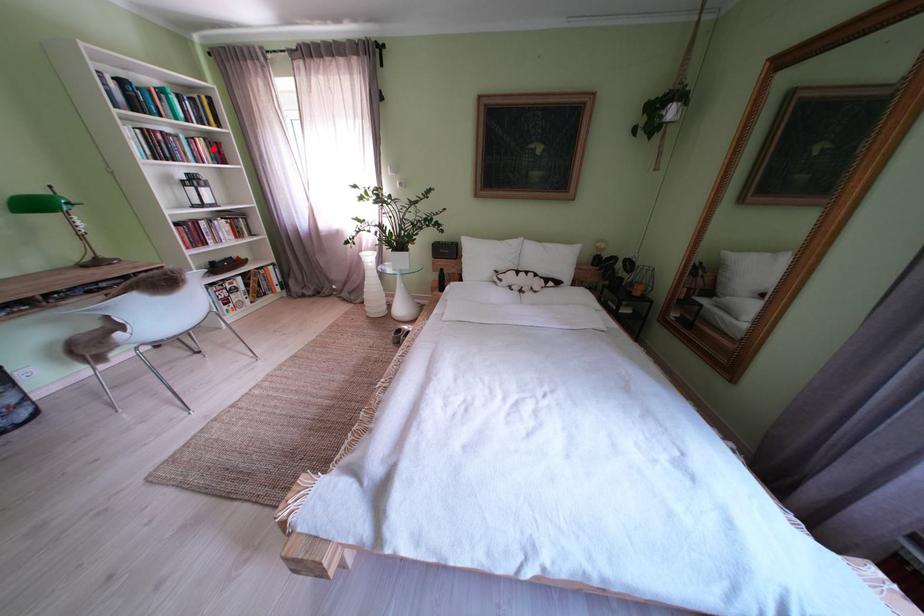
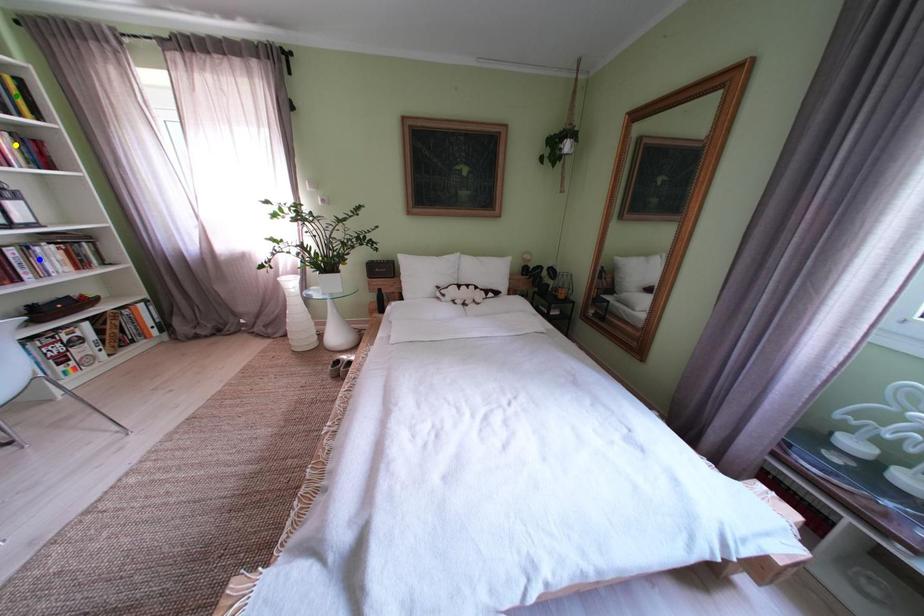
Question: I am providing you with two images of the same scene from different viewpoints. A red point is marked on the first image. You are given multiple points on the second image. In image 2, which mark is for the same physical point as the one in image 1?

Choices:
 (A) yellow point
 (B) blue point
 (C) green point

Answer: (A)